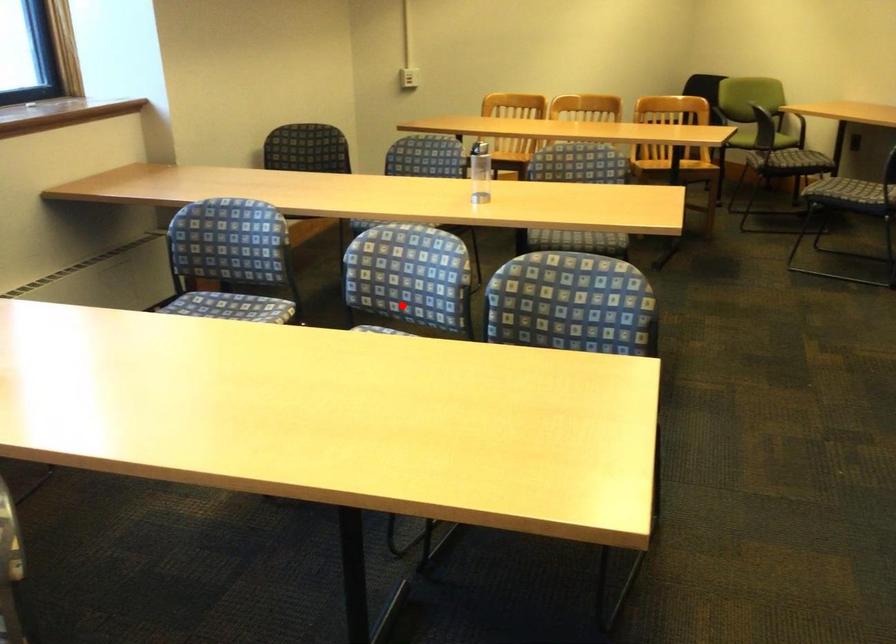
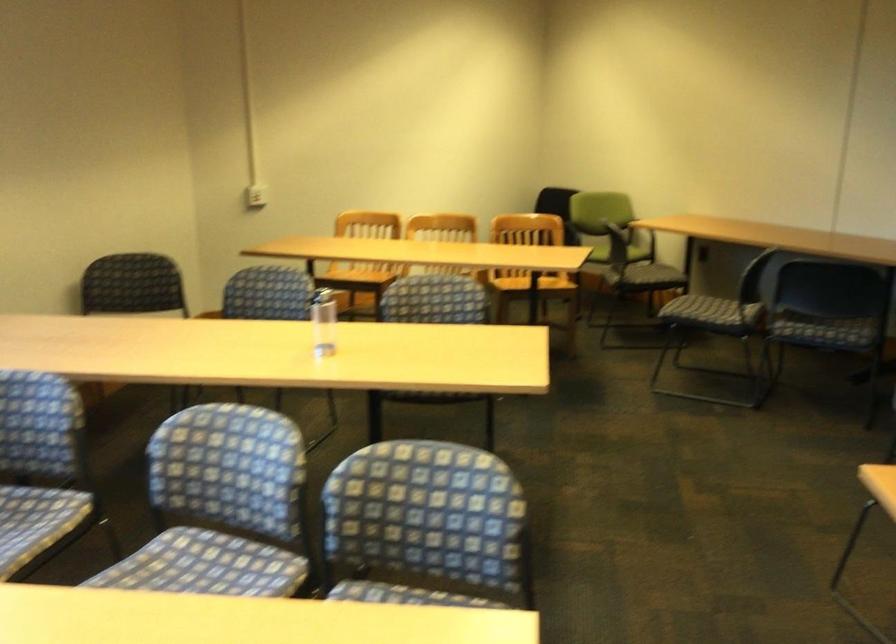
In the second image, find the point that corresponds to the highlighted location in the first image.

(221, 506)